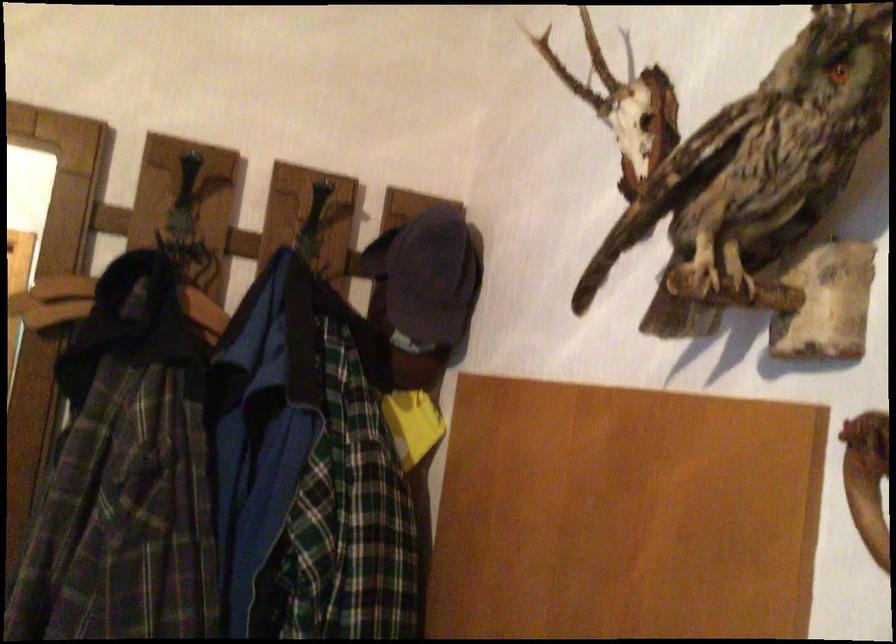
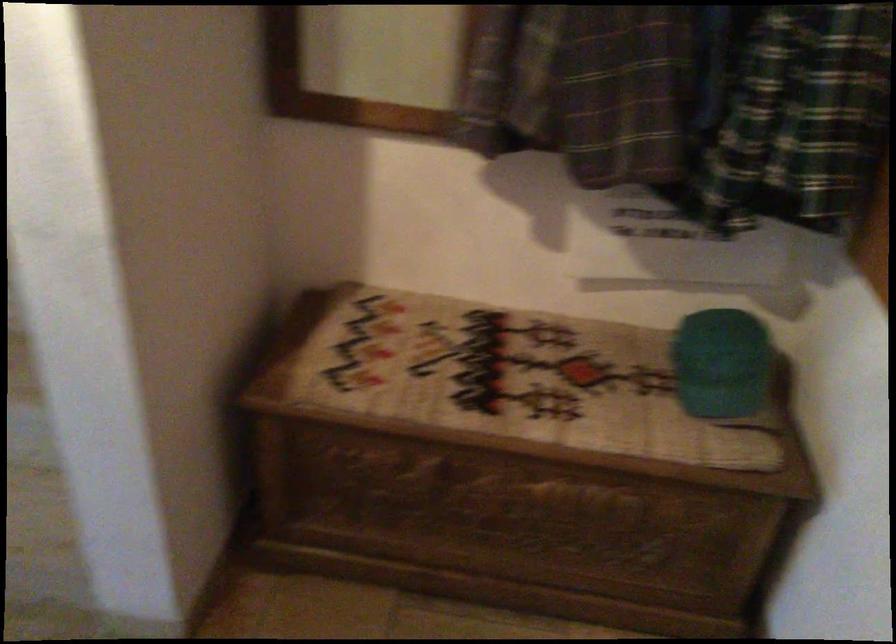
From the picture: The first image is from the beginning of the video and the second image is from the end. How did the camera likely rotate when shooting the video?

The rotation direction of the camera is left-down.